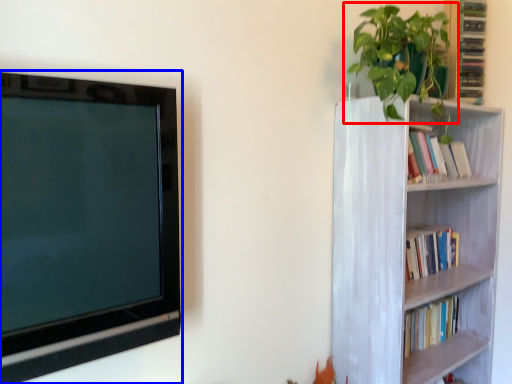
Question: Which of the following is the closest to the observer, houseplant (highlighted by a red box) or television (highlighted by a blue box)?

Choices:
 (A) houseplant
 (B) television

Answer: (B)